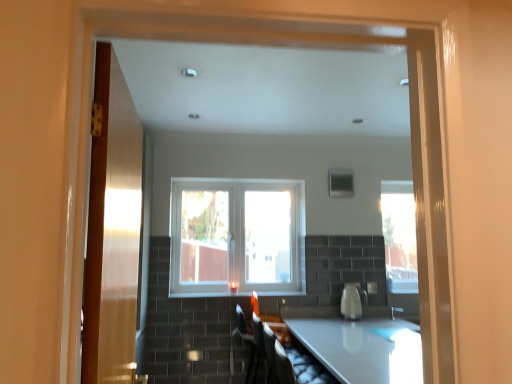
The image size is (512, 384). I want to click on vacant area on top of white glossy countertop at center (from a real-world perspective), so click(369, 345).